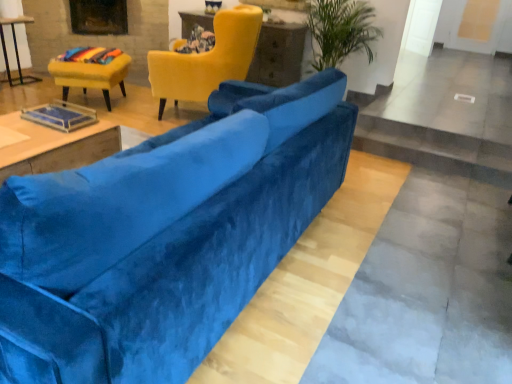
You are a GUI agent. You are given a task and a screenshot of the screen. Output one action in this format:
    pyautogui.click(x=<x>, y=<y>)
    Task: Click on the blank space situated above wooden table at center, the 2th table when ordered from left to right (from a real-world perspective)
    This screenshot has height=384, width=512.
    Given the screenshot: What is the action you would take?
    pyautogui.click(x=40, y=124)